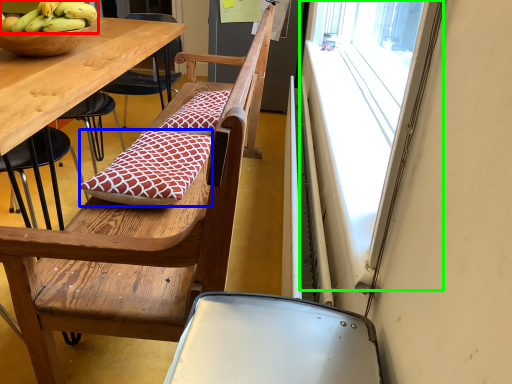
Question: Which object is the closest to the banana (highlighted by a red box)? Choose among these: pillow (highlighted by a blue box) or window (highlighted by a green box).

Choices:
 (A) pillow
 (B) window

Answer: (A)